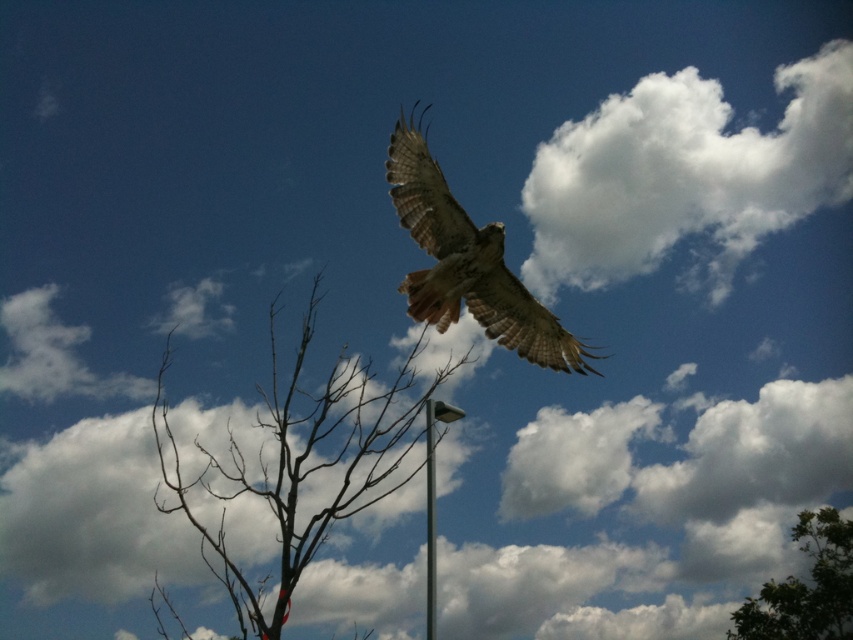
Question: Is brown feathered eagle at upper center bigger than metallic gray pole at center?

Choices:
 (A) yes
 (B) no

Answer: (A)

Question: Considering the real-world distances, which object is closest to the silver metallic pole at center?

Choices:
 (A) white fluffy cloud at upper right
 (B) green leafy tree at lower right
 (C) metallic gray pole at center
 (D) brown feathered eagle at upper center

Answer: (C)

Question: Can you confirm if brown feathered eagle at upper center is smaller than silver metallic pole at center?

Choices:
 (A) yes
 (B) no

Answer: (B)

Question: Can you confirm if brown/dry wood tree at center-left is positioned below green leafy tree at lower right?

Choices:
 (A) yes
 (B) no

Answer: (B)

Question: Which point appears closest to the camera in this image?

Choices:
 (A) (804, 586)
 (B) (695, 99)
 (C) (573, 355)

Answer: (C)

Question: Which of the following is the farthest from the observer?

Choices:
 (A) brown feathered eagle at upper center
 (B) green leafy tree at lower right
 (C) brown/dry wood tree at center-left
 (D) metallic gray pole at center

Answer: (B)